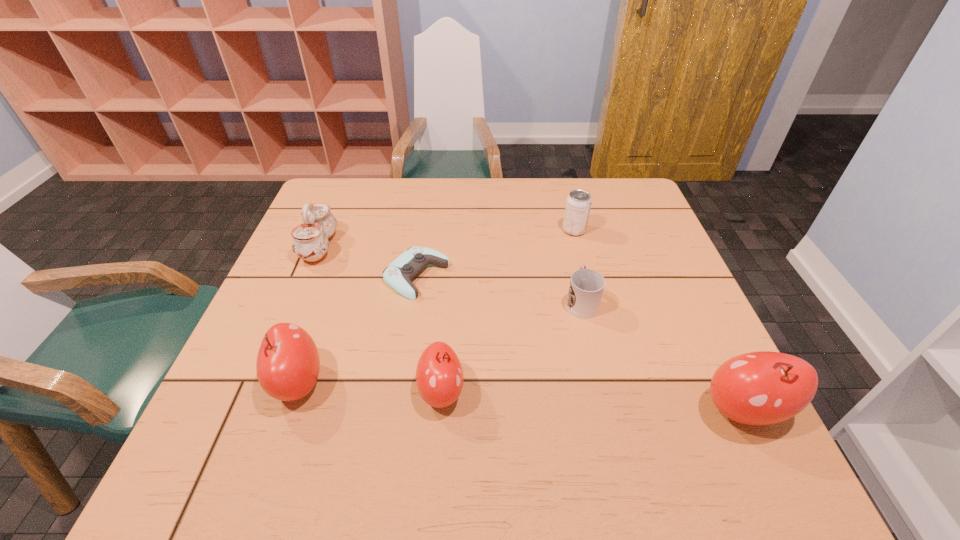
Locate which apple ranks second in proximity to the second shortest apple. Please provide its 2D coordinates. Your answer should be formatted as a tuple, i.e. [(x, y)], where the tuple contains the x and y coordinates of a point satisfying the conditions above.

[(760, 388)]

Choose which apple is the nearest neighbor to the second apple from right to left. Please provide its 2D coordinates. Your answer should be formatted as a tuple, i.e. [(x, y)], where the tuple contains the x and y coordinates of a point satisfying the conditions above.

[(288, 363)]

At what (x,y) coordinates should I click in order to perform the action: click on free space in the image that satisfies the following two spatial constraints: 1. by the handle of the second tallest apple; 2. on the right side of the chinaware. Please return your answer as a coordinate pair (x, y). This screenshot has height=540, width=960. Looking at the image, I should click on (262, 383).

I want to click on free point that satisfies the following two spatial constraints: 1. on the front side of the second shortest apple; 2. on the right side of the shortest apple, so coord(295,392).

What are the coordinates of `free region that satisfies the following two spatial constraints: 1. on the back side of the second shortest apple; 2. by the handle of the chinaware` in the screenshot? It's located at (346, 247).

You are a GUI agent. You are given a task and a screenshot of the screen. Output one action in this format:
    pyautogui.click(x=<x>, y=<y>)
    Task: Click on the free space that satisfies the following two spatial constraints: 1. on the side of the cup where the handle is located; 2. by the handle of the chinaware
    This screenshot has width=960, height=540.
    Given the screenshot: What is the action you would take?
    pyautogui.click(x=568, y=247)